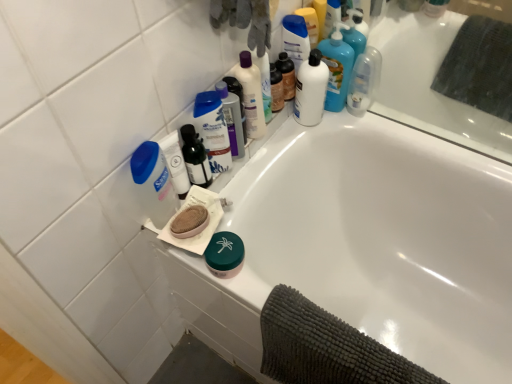
Question: From the image's perspective, relative to translucent plastic bottle at upper center, the 1th toiletry in the front-to-back sequence, is matte black bottle at upper center, the 1th toiletry viewed from the back, above or below?

Choices:
 (A) below
 (B) above

Answer: (B)

Question: Is matte black bottle at upper center, the 2th toiletry positioned from the left, situated inside translucent plastic bottle at upper center, positioned as the first toiletry in left-to-right order, or outside?

Choices:
 (A) inside
 (B) outside

Answer: (B)

Question: Which of these objects is positioned farthest from the blue plastic shampoo bottle at upper center, positioned as the fifth cleaning product in right-to-left order?

Choices:
 (A) white glossy bottle at upper right, marked as the sixth cleaning product in a left-to-right arrangement
 (B) translucent plastic soap dispenser at upper left, which is the 6th cleaning product in right-to-left order
 (C) clear plastic bottle at upper right, marked as the 1th mouthwash in a right-to-left arrangement
 (D) white glossy bottle at upper center, arranged as the 2th mouthwash when viewed from the right
 (E) blue plastic mouthwash at upper center, acting as the second mouthwash starting from the left

Answer: (C)

Question: Estimate the real-world distances between objects in this image. Which object is farther from the translucent plastic soap dispenser at upper left, which is the 6th cleaning product in right-to-left order?

Choices:
 (A) white glossy bottle at upper right, marked as the sixth cleaning product in a left-to-right arrangement
 (B) dark gray textured towel at lower right
 (C) matte black bottle at upper center, which is the first toiletry from right to left
 (D) white glossy bathtub at upper center
 (E) blue plastic bottle at upper left, the 4th mouthwash from the right

Answer: (A)